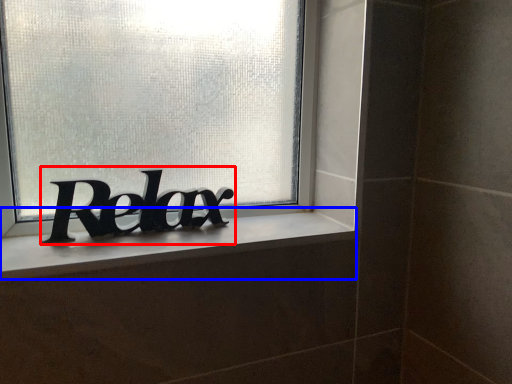
Question: Which object is further to the camera taking this photo, lettering (highlighted by a red box) or window sill (highlighted by a blue box)?

Choices:
 (A) lettering
 (B) window sill

Answer: (A)